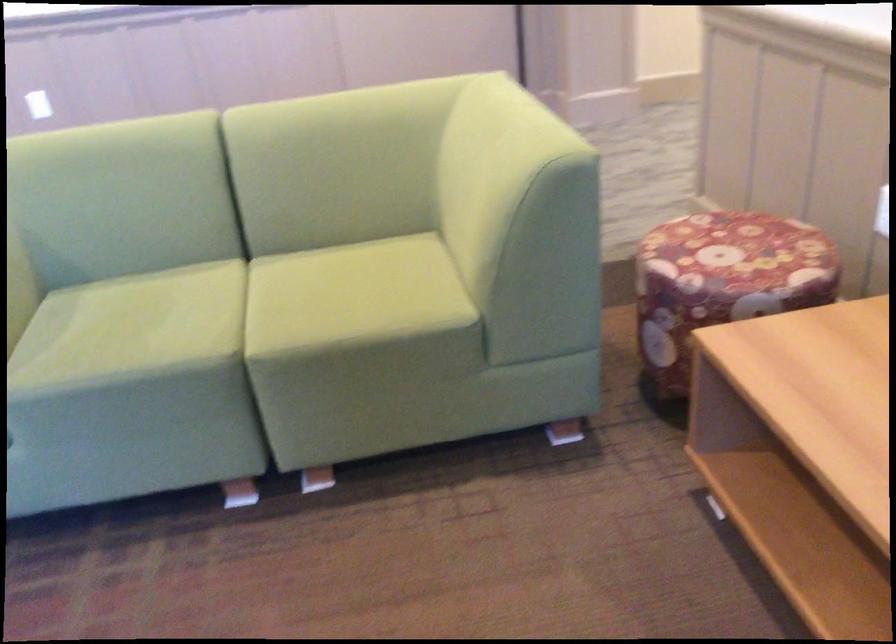
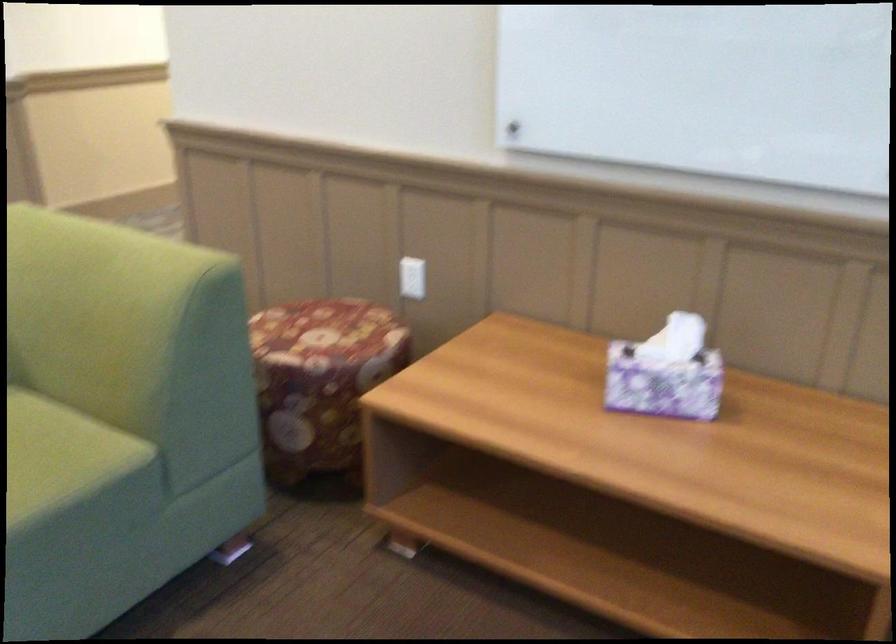
Question: How did the camera likely rotate?

Choices:
 (A) Left
 (B) Right
 (C) Up
 (D) Down

Answer: (B)